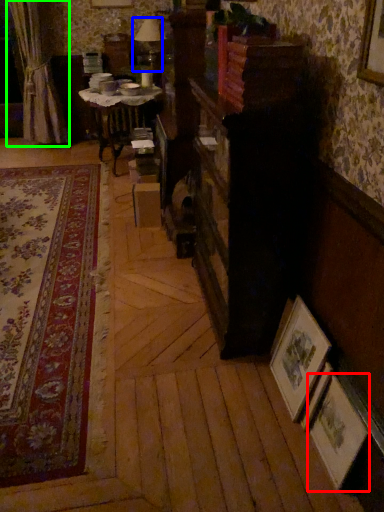
Question: Which object is the farthest from picture frame (highlighted by a red box)? Choose among these: table lamp (highlighted by a blue box) or curtain (highlighted by a green box).

Choices:
 (A) table lamp
 (B) curtain

Answer: (B)